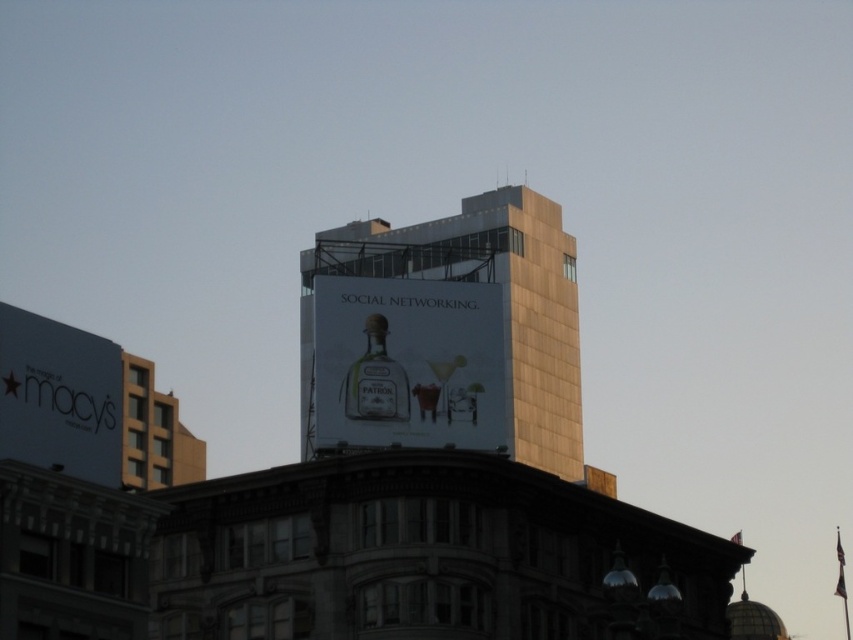
Question: Can you confirm if gold metallic building at center is positioned above white glossy sign at lower left?

Choices:
 (A) yes
 (B) no

Answer: (B)

Question: Is gold metallic building at center closer to the viewer compared to matte glass bottle at upper center?

Choices:
 (A) no
 (B) yes

Answer: (A)

Question: Which point is closer to the camera?

Choices:
 (A) gold metallic building at center
 (B) matte glass bottle at upper center
 (C) clear glass bottle at center

Answer: (B)

Question: In this image, where is matte glass bottle at upper center located relative to clear glass bottle at center?

Choices:
 (A) below
 (B) above

Answer: (B)

Question: Which object is the closest to the matte glass bottle at upper center?

Choices:
 (A) gold metallic building at center
 (B) white glossy sign at lower left
 (C) clear glass bottle at center

Answer: (C)

Question: Among these points, which one is nearest to the camera?

Choices:
 (A) (97, 420)
 (B) (387, 316)

Answer: (A)